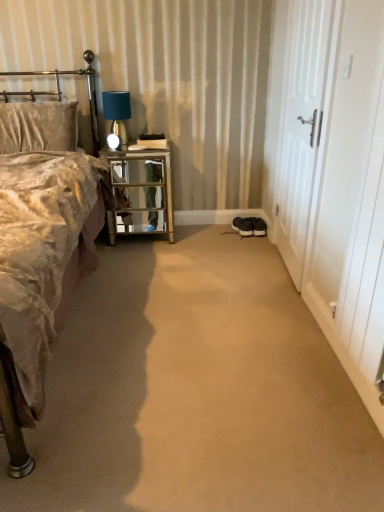
The height and width of the screenshot is (512, 384). What do you see at coordinates (142, 191) in the screenshot?
I see `metal/mirrored nightstand at left` at bounding box center [142, 191].

Locate an element on the screen. The width and height of the screenshot is (384, 512). velvet gold bed at left is located at coordinates (12, 425).

What do you see at coordinates (12, 425) in the screenshot? I see `velvet gold bed at left` at bounding box center [12, 425].

What do you see at coordinates (61, 93) in the screenshot?
I see `metallic gold headboard at upper left` at bounding box center [61, 93].

What is the approximate width of white wooden door at right, the 2th screen door in the front-to-back sequence?

white wooden door at right, the 2th screen door in the front-to-back sequence, is 2.34 inches in width.

The width and height of the screenshot is (384, 512). What are the coordinates of `metal/mirrored nightstand at left` in the screenshot? It's located at (x=142, y=191).

Is black suede sneakers at lower center facing away from white wooden screen door at right, the 2th screen door when ordered from back to front?

No.

Consider the image. Based on their sizes in the image, would you say black suede sneakers at lower center is bigger or smaller than white wooden screen door at right, the 2th screen door when ordered from back to front?

In the image, black suede sneakers at lower center appears to be smaller than white wooden screen door at right, the 2th screen door when ordered from back to front.

Based on the photo, which of these two, black suede sneakers at lower center or white wooden screen door at right, the 1th screen door viewed from the front, stands shorter?

black suede sneakers at lower center.

In the scene shown: Which of these two, black suede sneakers at lower center or white wooden screen door at right, the 2th screen door when ordered from back to front, is thinner?

Thinner between the two is white wooden screen door at right, the 2th screen door when ordered from back to front.

Is black suede sneakers at lower center taller or shorter than metal/mirrored nightstand at left?

Clearly, black suede sneakers at lower center is shorter compared to metal/mirrored nightstand at left.

Considering the sizes of objects black suede sneakers at lower center and metal/mirrored nightstand at left in the image provided, who is thinner, black suede sneakers at lower center or metal/mirrored nightstand at left?

Thinner between the two is black suede sneakers at lower center.

From a real-world perspective, which object rests below the other?

black suede sneakers at lower center.

Is black suede sneakers at lower center facing towards metal/mirrored nightstand at left?

No.

From the image's perspective, is white wooden screen door at right, the 2th screen door when ordered from back to front, located above or below matte blue glass table lamp at upper left?

white wooden screen door at right, the 2th screen door when ordered from back to front, is situated lower than matte blue glass table lamp at upper left in the image.

Measure the distance between white wooden screen door at right, the 1th screen door viewed from the front, and matte blue glass table lamp at upper left.

white wooden screen door at right, the 1th screen door viewed from the front, is 5.29 feet from matte blue glass table lamp at upper left.

The image size is (384, 512). I want to click on table lamp that appears above the white wooden screen door at right, the 2th screen door when ordered from back to front (from a real-world perspective), so click(117, 117).

Considering the positions of point (340, 205) and point (125, 102), is point (340, 205) closer or farther from the camera than point (125, 102)?

Clearly, point (340, 205) is closer to the camera than point (125, 102).

How much distance is there between white wooden screen door at right, the 2th screen door when ordered from back to front, and metal/mirrored nightstand at left?

The distance of white wooden screen door at right, the 2th screen door when ordered from back to front, from metal/mirrored nightstand at left is 1.33 meters.

Is white wooden screen door at right, the 2th screen door when ordered from back to front, facing away from metal/mirrored nightstand at left?

No, metal/mirrored nightstand at left is not at the back of white wooden screen door at right, the 2th screen door when ordered from back to front.

Between white wooden screen door at right, the 2th screen door when ordered from back to front, and metal/mirrored nightstand at left, which one is positioned in front?

white wooden screen door at right, the 2th screen door when ordered from back to front, is more forward.

Which is more to the left, white wooden screen door at right, the 1th screen door viewed from the front, or metal/mirrored nightstand at left?

Positioned to the left is metal/mirrored nightstand at left.

Between white wooden screen door at right, the 1th screen door viewed from the front, and white wooden door at right, the 2th screen door in the front-to-back sequence, which one appears on the right side from the viewer's perspective?

From the viewer's perspective, white wooden screen door at right, the 1th screen door viewed from the front, appears more on the right side.

Considering the sizes of objects white wooden screen door at right, the 2th screen door when ordered from back to front, and white wooden door at right, the 1th screen door from the back, in the image provided, who is thinner, white wooden screen door at right, the 2th screen door when ordered from back to front, or white wooden door at right, the 1th screen door from the back,?

white wooden door at right, the 1th screen door from the back, is thinner.

Are white wooden screen door at right, the 1th screen door viewed from the front, and white wooden door at right, the 2th screen door in the front-to-back sequence, far apart?

Actually, white wooden screen door at right, the 1th screen door viewed from the front, and white wooden door at right, the 2th screen door in the front-to-back sequence, are a little close together.

From the image's perspective, which is below, white wooden screen door at right, the 2th screen door when ordered from back to front, or white wooden door at right, the 1th screen door from the back?

white wooden screen door at right, the 2th screen door when ordered from back to front, from the image's perspective.

In terms of width, does white wooden door at right, the 2th screen door in the front-to-back sequence, look wider or thinner when compared to matte blue glass table lamp at upper left?

→ Considering their sizes, white wooden door at right, the 2th screen door in the front-to-back sequence, looks slimmer than matte blue glass table lamp at upper left.

In the scene shown: From the image's perspective, which object appears higher, white wooden door at right, the 2th screen door in the front-to-back sequence, or matte blue glass table lamp at upper left?

matte blue glass table lamp at upper left.

Is matte blue glass table lamp at upper left not within metal/mirrored nightstand at left?

Yes, matte blue glass table lamp at upper left is outside of metal/mirrored nightstand at left.

In the scene shown: Is matte blue glass table lamp at upper left shorter than metal/mirrored nightstand at left?

Yes, matte blue glass table lamp at upper left is shorter than metal/mirrored nightstand at left.

From a real-world perspective, is matte blue glass table lamp at upper left over metal/mirrored nightstand at left?

Yes, from a real-world perspective, matte blue glass table lamp at upper left is above metal/mirrored nightstand at left.

You are a GUI agent. You are given a task and a screenshot of the screen. Output one action in this format:
    pyautogui.click(x=<x>, y=<y>)
    Task: Click on the 1st screen door located above the black suede sneakers at lower center (from a real-world perspective)
    The width and height of the screenshot is (384, 512).
    Given the screenshot: What is the action you would take?
    pyautogui.click(x=348, y=158)

The image size is (384, 512). Find the location of `nightstand that is on the left side of black suede sneakers at lower center`. nightstand that is on the left side of black suede sneakers at lower center is located at coordinates (142, 191).

From the image, which object appears to be nearer to metal/mirrored nightstand at left, velvet gold bed at left or white wooden screen door at right, the 1th screen door viewed from the front?

The object closer to metal/mirrored nightstand at left is velvet gold bed at left.

Looking at this image, when comparing their distances from metallic gold headboard at upper left, does white wooden screen door at right, the 1th screen door viewed from the front, or metal/mirrored nightstand at left seem closer?

The object closer to metallic gold headboard at upper left is metal/mirrored nightstand at left.

Based on the photo, looking at the image, which one is located further to black suede sneakers at lower center, matte blue glass table lamp at upper left or white wooden screen door at right, the 1th screen door viewed from the front?

white wooden screen door at right, the 1th screen door viewed from the front.

Which object lies nearer to the anchor point matte blue glass table lamp at upper left, metallic gold headboard at upper left or velvet gold bed at left?

metallic gold headboard at upper left lies closer to matte blue glass table lamp at upper left than the other object.

Looking at the image, which one is located closer to matte blue glass table lamp at upper left, white wooden screen door at right, the 2th screen door when ordered from back to front, or metal/mirrored nightstand at left?

metal/mirrored nightstand at left lies closer to matte blue glass table lamp at upper left than the other object.

Looking at the image, which one is located closer to black suede sneakers at lower center, metallic gold headboard at upper left or metal/mirrored nightstand at left?

metal/mirrored nightstand at left is closer to black suede sneakers at lower center.

Considering their positions, is metal/mirrored nightstand at left positioned further to white wooden door at right, the 1th screen door from the back, than velvet gold bed at left?

velvet gold bed at left is further to white wooden door at right, the 1th screen door from the back.

When comparing their distances from metallic gold headboard at upper left, does metal/mirrored nightstand at left or white wooden screen door at right, the 1th screen door viewed from the front, seem further?

The object further to metallic gold headboard at upper left is white wooden screen door at right, the 1th screen door viewed from the front.

The image size is (384, 512). I want to click on headboard located between white wooden screen door at right, the 2th screen door when ordered from back to front, and black suede sneakers at lower center in the depth direction, so click(x=61, y=93).

Where is `table lamp positioned between white wooden screen door at right, the 1th screen door viewed from the front, and black suede sneakers at lower center from near to far`? The width and height of the screenshot is (384, 512). table lamp positioned between white wooden screen door at right, the 1th screen door viewed from the front, and black suede sneakers at lower center from near to far is located at coordinates (117, 117).

The width and height of the screenshot is (384, 512). Find the location of `bed between metallic gold headboard at upper left and white wooden screen door at right, the 1th screen door viewed from the front`. bed between metallic gold headboard at upper left and white wooden screen door at right, the 1th screen door viewed from the front is located at coordinates (12, 425).

Identify the location of table lamp situated between metallic gold headboard at upper left and black suede sneakers at lower center from left to right. (117, 117).